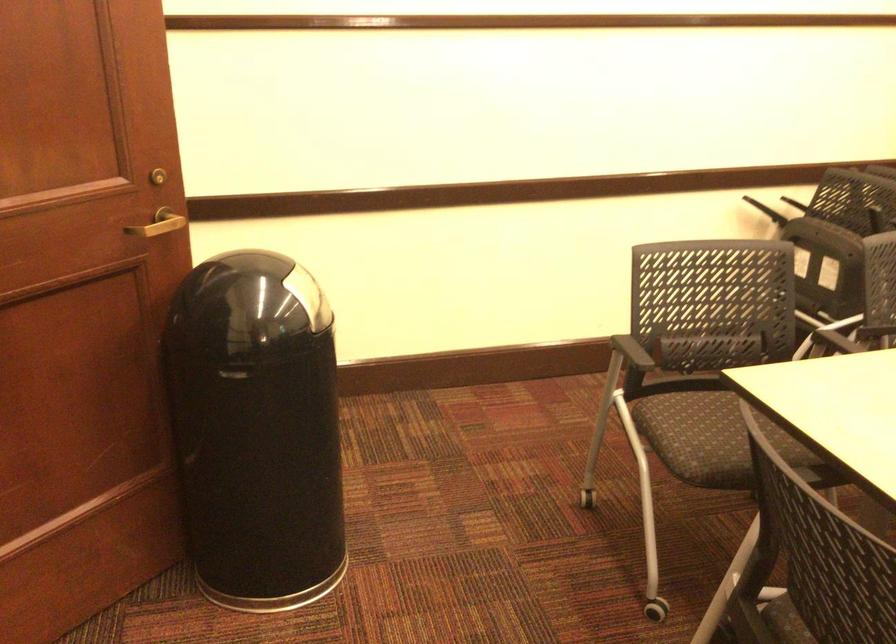
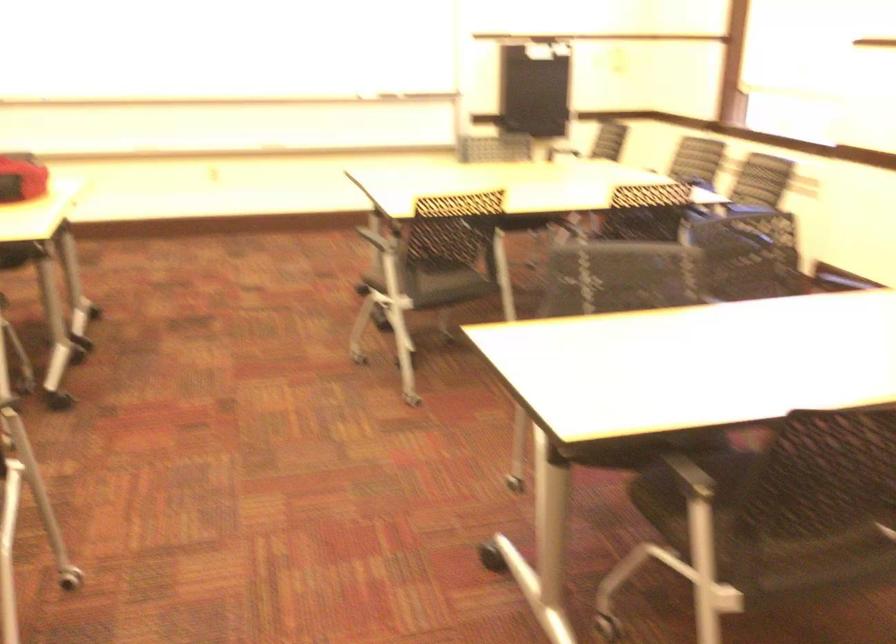
The images are taken continuously from a first-person perspective. In which direction is your viewpoint rotating?

The camera rotated toward right-down.